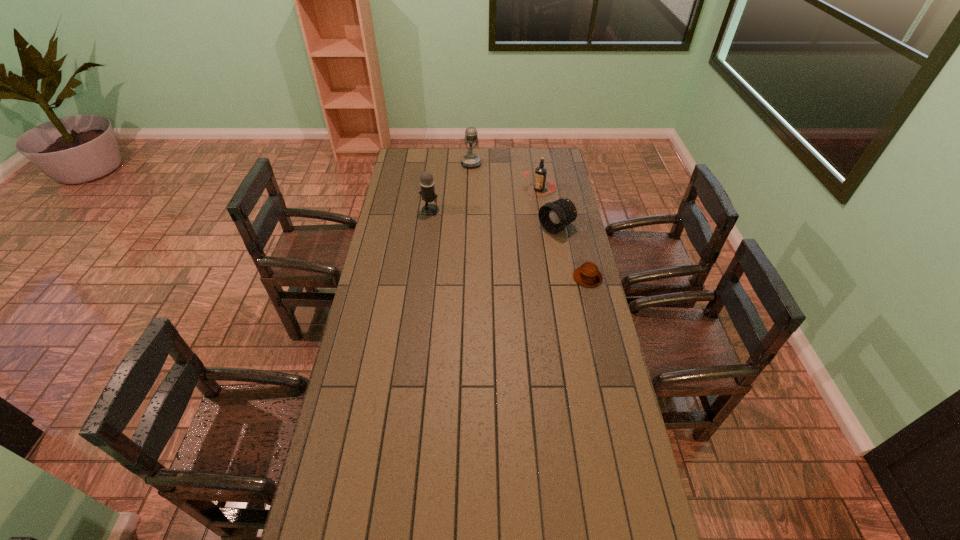
The image size is (960, 540). Find the location of `free spot located on the front of the left microphone`. free spot located on the front of the left microphone is located at coordinates (426, 242).

Locate an element on the screen. vacant space located 0.110m on the front of the muffin is located at coordinates (595, 309).

At what (x,y) coordinates should I click in order to perform the action: click on free space located at the front element of the fourth tallest object. Please return your answer as a coordinate pair (x, y). This screenshot has width=960, height=540. Looking at the image, I should click on (509, 256).

Find the location of a particular element. This screenshot has height=540, width=960. vacant space located 0.050m at the front element of the fourth tallest object is located at coordinates (535, 240).

Identify the location of vacant space situated at the front element of the fourth tallest object. (530, 243).

Locate an element on the screen. The height and width of the screenshot is (540, 960). free space located on the label of the third shortest object is located at coordinates (517, 203).

At what (x,y) coordinates should I click in order to perform the action: click on vacant space situated 0.090m on the label of the third shortest object. Please return your answer as a coordinate pair (x, y). The image size is (960, 540). Looking at the image, I should click on (517, 203).

You are a GUI agent. You are given a task and a screenshot of the screen. Output one action in this format:
    pyautogui.click(x=<x>, y=<y>)
    Task: Click on the blank space located 0.270m on the label of the third shortest object
    This screenshot has height=540, width=960.
    Given the screenshot: What is the action you would take?
    pyautogui.click(x=493, y=220)

Image resolution: width=960 pixels, height=540 pixels. Find the location of `vacant space situated on the front-facing side of the farthest object`. vacant space situated on the front-facing side of the farthest object is located at coordinates (477, 192).

This screenshot has width=960, height=540. I want to click on free space located 0.210m on the front-facing side of the farthest object, so click(477, 192).